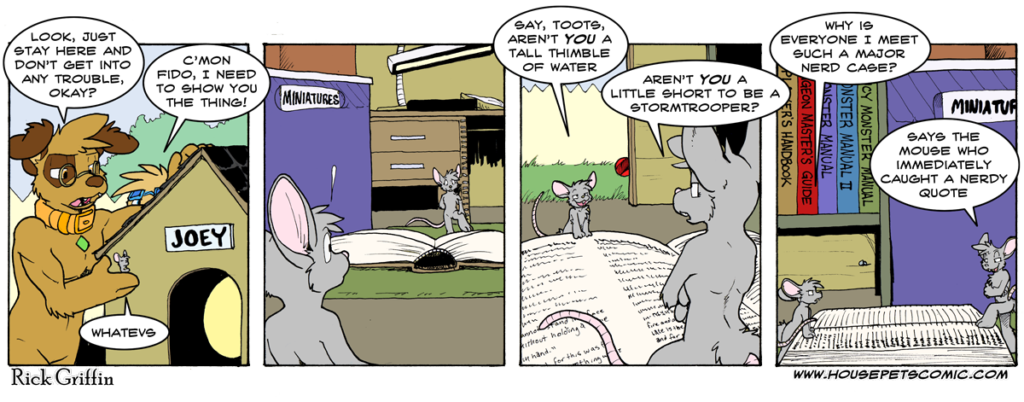
This screenshot has width=1024, height=402. I want to click on purple wall, so click(347, 129), click(926, 237).